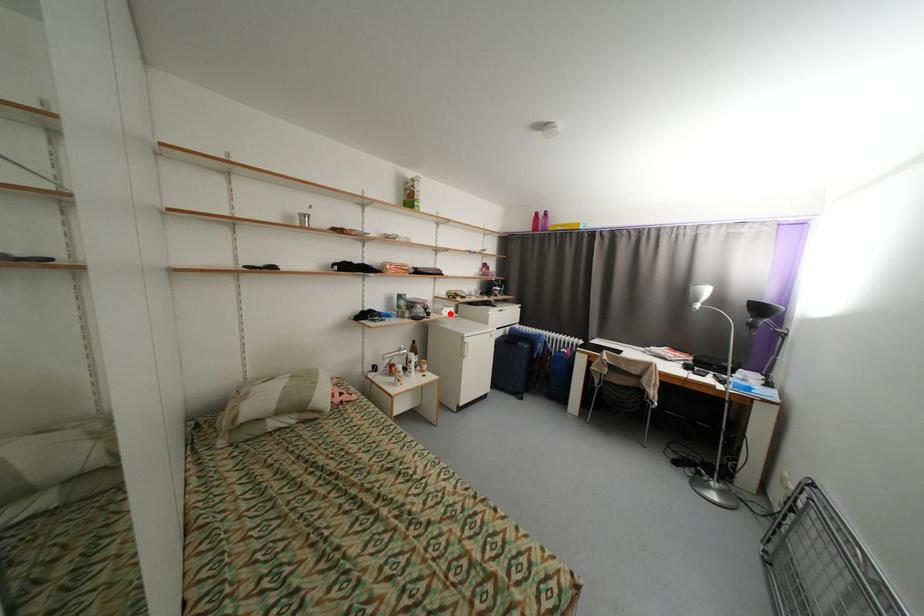
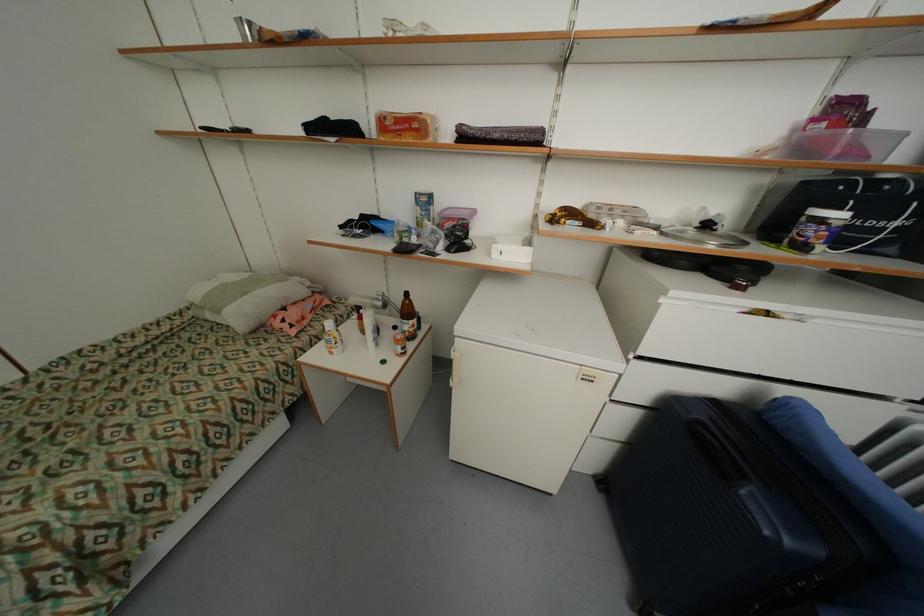
Where in the second image is the point corresponding to the highlighted location from the first image?

(502, 256)